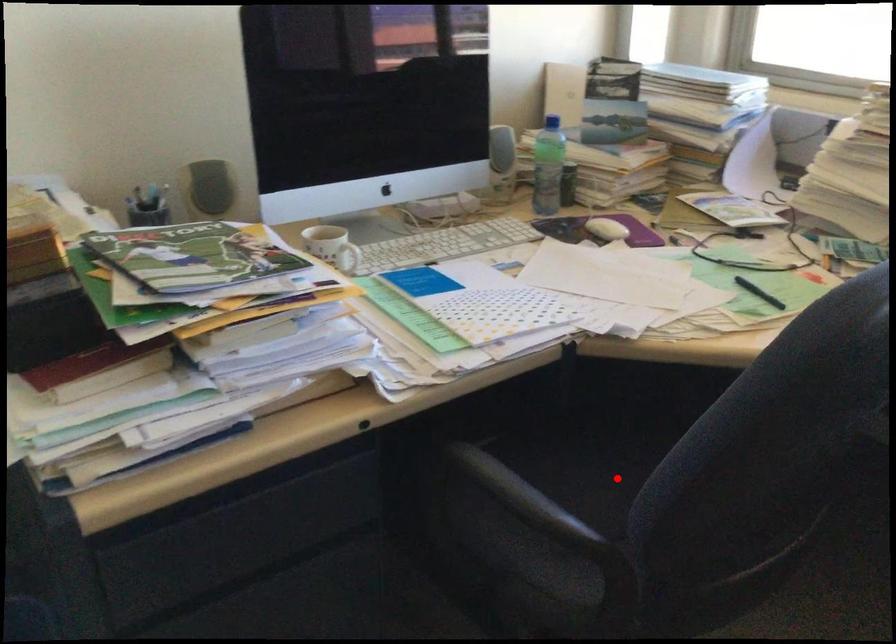
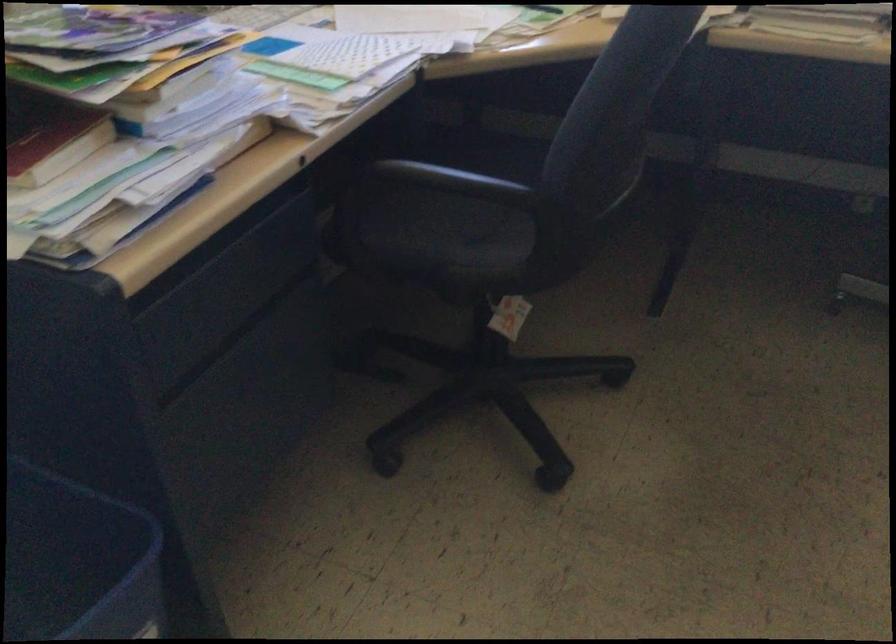
Question: I am providing you with two images of the same scene from different viewpoints. A red point is marked on the first image. Can you still see the location of the red point in image 2?

Choices:
 (A) Yes
 (B) No

Answer: (B)